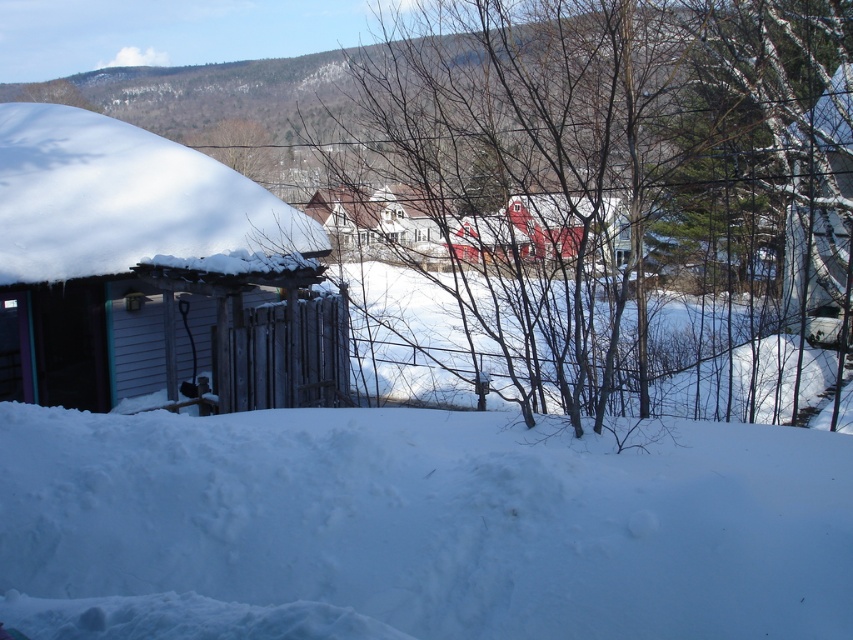
Is red matte barn at center shorter than bare wood tree at upper center?

Yes.

Between point (560, 237) and point (254, 180), which one is positioned in front?

Point (560, 237) is in front.

Where is `red matte barn at center`? The image size is (853, 640). red matte barn at center is located at coordinates (543, 228).

Which is more to the right, bare branches at center or wooden shed at left?

Positioned to the right is bare branches at center.

The height and width of the screenshot is (640, 853). What do you see at coordinates (613, 161) in the screenshot? I see `bare branches at center` at bounding box center [613, 161].

Is point (541, 40) more distant than point (119, 282)?

Yes, it is behind point (119, 282).

Identify the location of bare branches at center. The height and width of the screenshot is (640, 853). (613, 161).

Is point (154, 227) more distant than point (225, 150)?

That is False.

Is point (180, 275) positioned behind point (253, 170)?

No, (180, 275) is in front of (253, 170).

I want to click on wooden shed at left, so click(x=155, y=268).